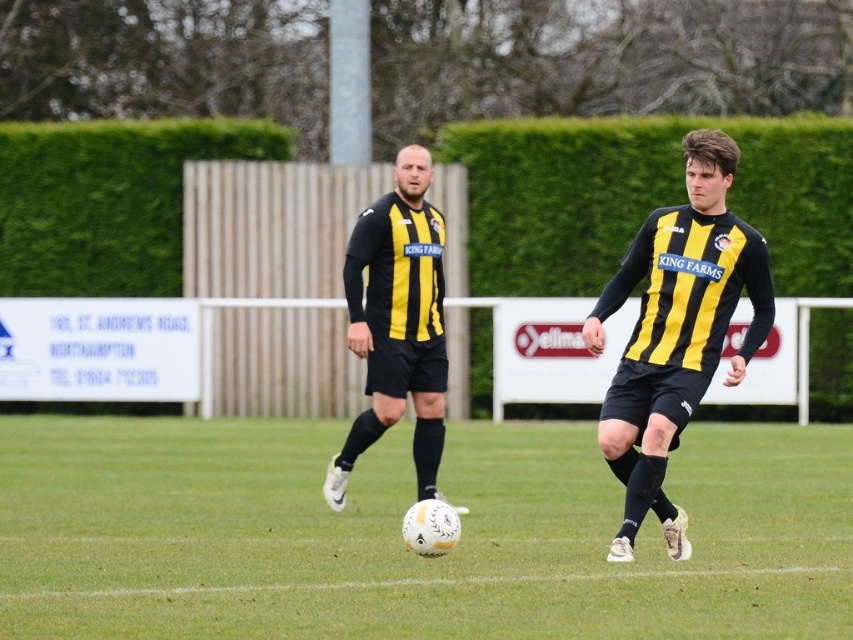
Question: In this image, where is green grass football field at center located relative to yellow matte jersey at center?

Choices:
 (A) left
 (B) right

Answer: (A)

Question: Which point is closer to the camera?

Choices:
 (A) (67, 180)
 (B) (175, 477)
 (C) (576, 163)
 (D) (654, 486)

Answer: (D)

Question: From the image, what is the correct spatial relationship of green grass football field at center in relation to green leafy hedge at center?

Choices:
 (A) above
 (B) below

Answer: (B)

Question: Which point is farther from the camera taking this photo?

Choices:
 (A) (688, 396)
 (B) (215, 148)
 (C) (341, 476)

Answer: (B)

Question: Which of these objects is positioned farthest from the green grass football field at center?

Choices:
 (A) green leafy hedge at center
 (B) yellow/black striped jersey at center

Answer: (A)

Question: Observing the image, what is the correct spatial positioning of green grass football field at center in reference to yellow/black striped jersey at center?

Choices:
 (A) below
 (B) above

Answer: (A)